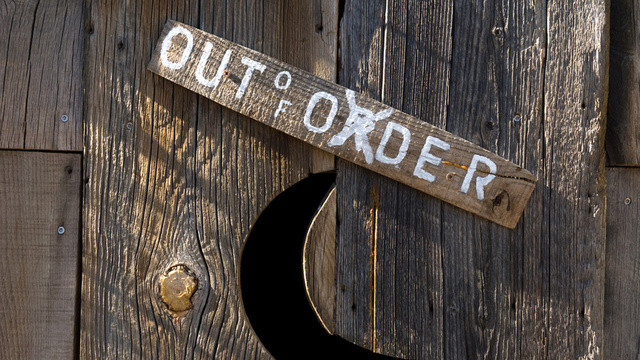
This screenshot has height=360, width=640. In order to click on wooden plank in this screenshot , I will do `click(61, 311)`, `click(68, 44)`.